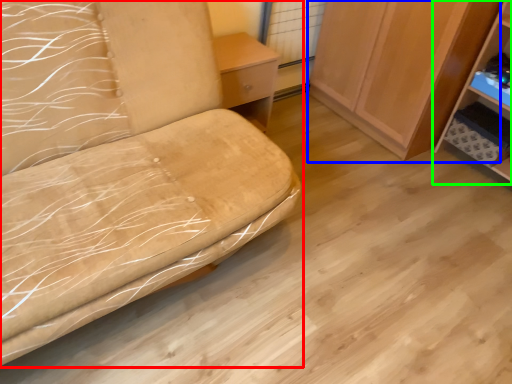
Question: Considering the real-world distances, which object is closest to furniture (highlighted by a red box)? cabinetry (highlighted by a blue box) or shelf (highlighted by a green box).

Choices:
 (A) cabinetry
 (B) shelf

Answer: (A)